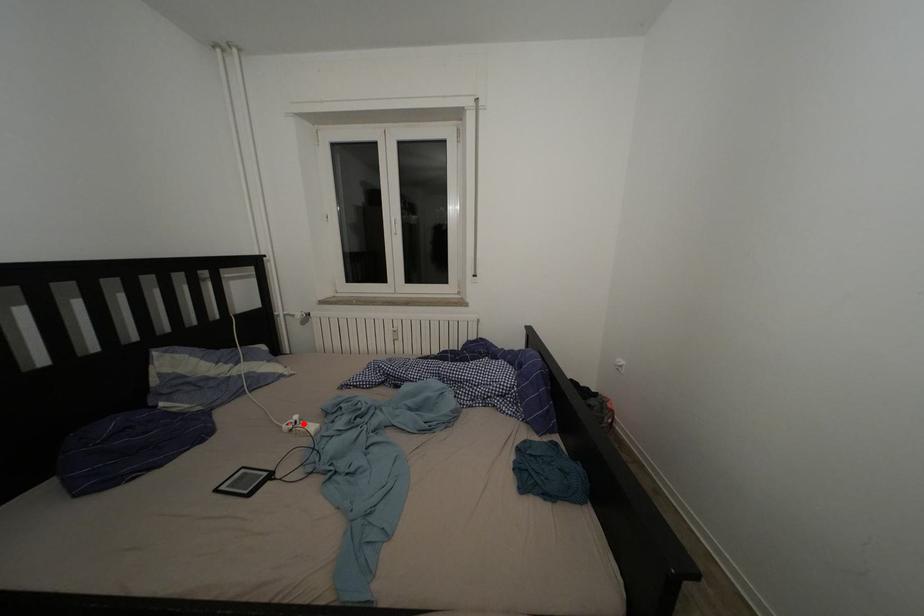
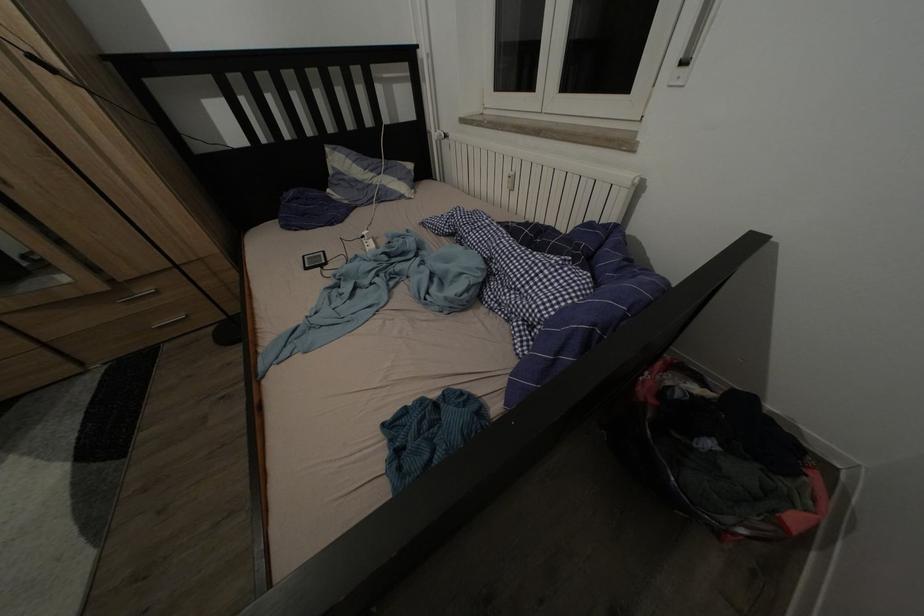
The point at the highlighted location is marked in the first image. Where is the corresponding point in the second image?

(372, 238)